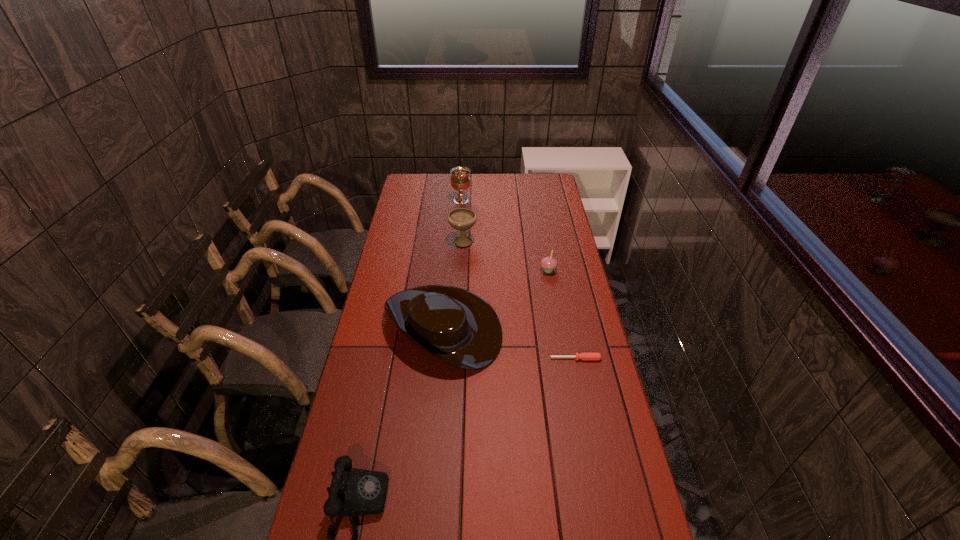
Where is `free space located on the left of the cupcake`? free space located on the left of the cupcake is located at coordinates (478, 270).

Locate an element on the screen. vacant space located 0.090m on the back of the screwdriver is located at coordinates (571, 335).

You are a GUI agent. You are given a task and a screenshot of the screen. Output one action in this format:
    pyautogui.click(x=<x>, y=<y>)
    Task: Click on the object that is at the far edge
    
    Given the screenshot: What is the action you would take?
    pyautogui.click(x=460, y=180)

Where is `object that is at the left edge`? This screenshot has height=540, width=960. object that is at the left edge is located at coordinates (460, 328).

Locate an element on the screen. This screenshot has height=540, width=960. cupcake that is positioned at the right edge is located at coordinates (549, 263).

Identify the location of screwdriver at the right edge. The width and height of the screenshot is (960, 540). (583, 356).

Locate an element on the screen. vacant area at the far edge is located at coordinates (487, 174).

In the image, there is a desktop. Identify the location of vacant space at the left edge. (365, 365).

In the image, there is a desktop. At what (x,y) coordinates should I click in order to perform the action: click on vacant area at the right edge. Please return your answer as a coordinate pair (x, y). This screenshot has height=540, width=960. Looking at the image, I should click on (559, 198).

At what (x,y) coordinates should I click in order to perform the action: click on vacant space at the far right corner. Please return your answer as a coordinate pair (x, y). The width and height of the screenshot is (960, 540). Looking at the image, I should click on (534, 185).